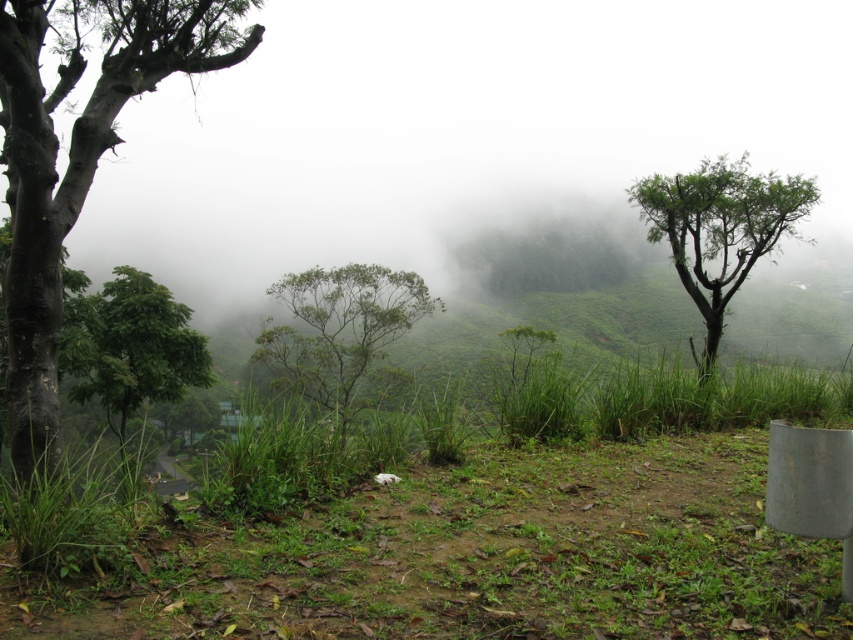
Which is below, green leafy tree at right or green leafy tree at center?

green leafy tree at center is lower down.

Between green leafy tree at right and green leafy tree at center, which one has more height?

With more height is green leafy tree at center.

The image size is (853, 640). I want to click on green leafy tree at right, so click(720, 228).

Locate an element on the screen. green leafy tree at right is located at coordinates (720, 228).

Where is `dark brown bark tree at left`? dark brown bark tree at left is located at coordinates (77, 157).

Is dark brown bark tree at left to the left of green leafy tree at lower left from the viewer's perspective?

No, dark brown bark tree at left is not to the left of green leafy tree at lower left.

What are the coordinates of `dark brown bark tree at left` in the screenshot? It's located at (77, 157).

Between green leafy tree at center and green leafy tree at lower left, which one is positioned higher?

Positioned higher is green leafy tree at lower left.

Between point (303, 291) and point (85, 316), which one is positioned behind?

The point (303, 291) is more distant.

Identify the location of green leafy tree at center. (340, 330).